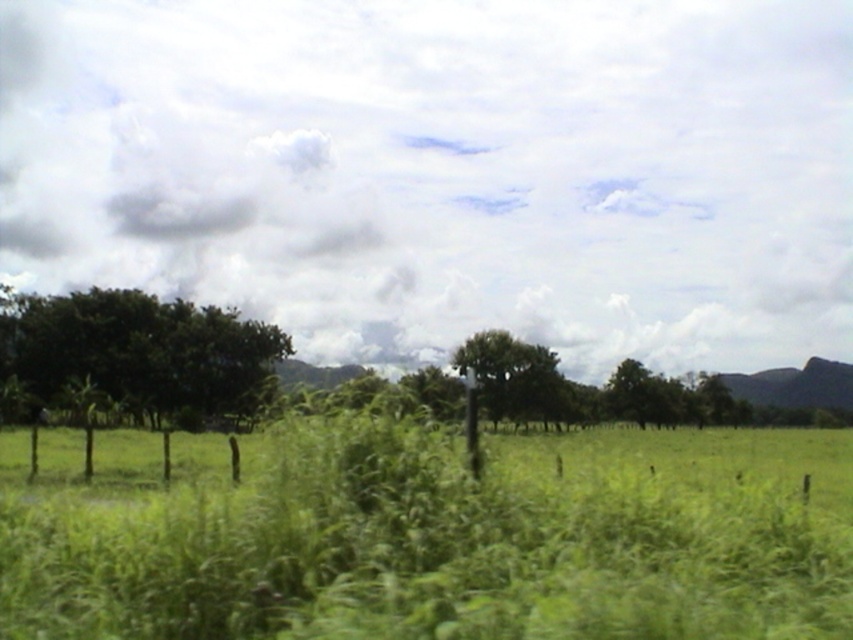
You are standing in the rural landscape shown in the image. There are two points marked in the scene. The first point is at coordinates point (422,614) and the second is at point (518,360). Which of these points is closer to you?

Point (422,614) is closer to the viewer than point (518,360).

You are standing in the rural landscape and want to determine the relative positions of two points marked in the image. Which point, point (262, 384) or point (491, 397), is closer to you?

Point (262, 384) is closer to the camera than point (491, 397).